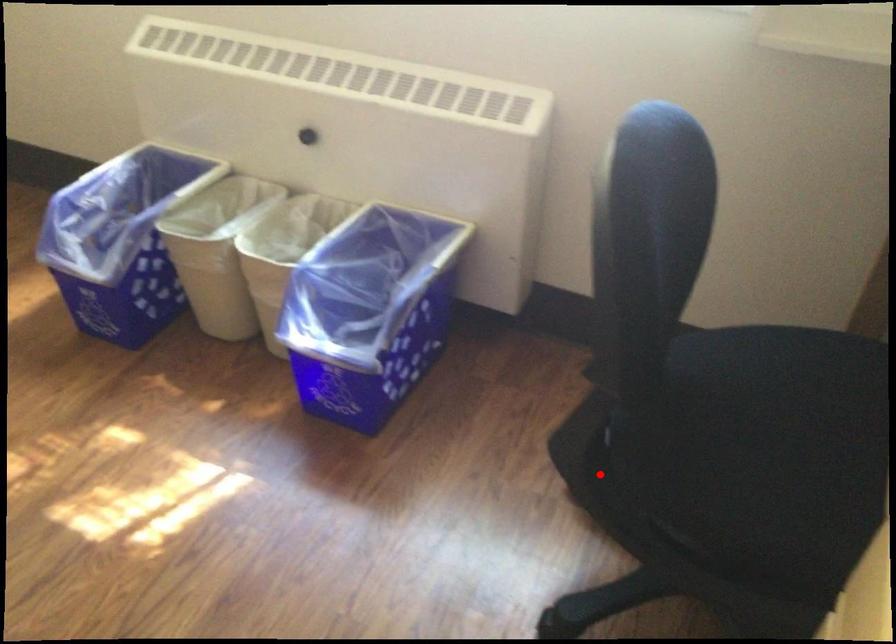
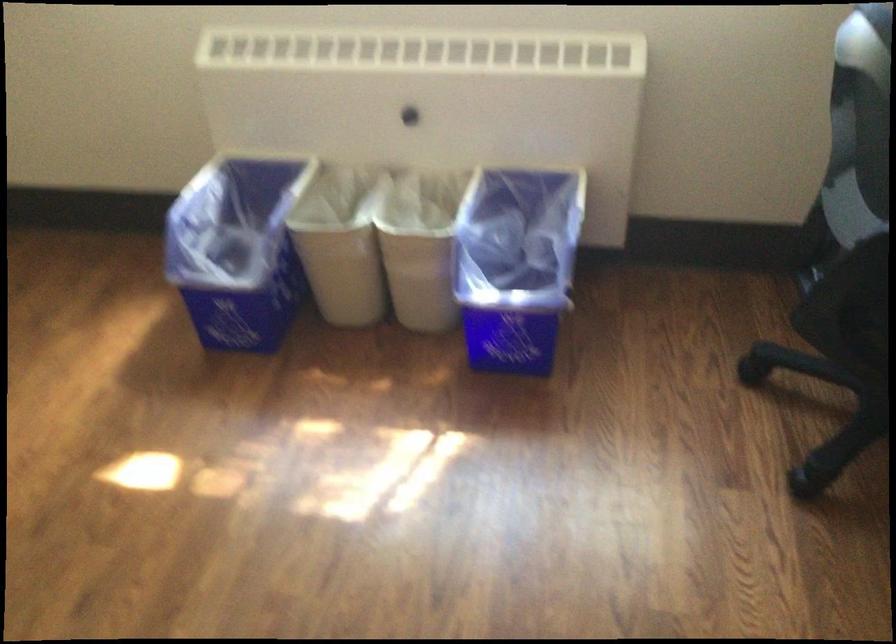
Question: I am providing you with two images of the same scene from different viewpoints. Image1 has a red point marked. In image2, the corresponding 3D location appears at what relative position? Reply with the corresponding letter.

Choices:
 (A) Closer
 (B) Farther

Answer: (B)